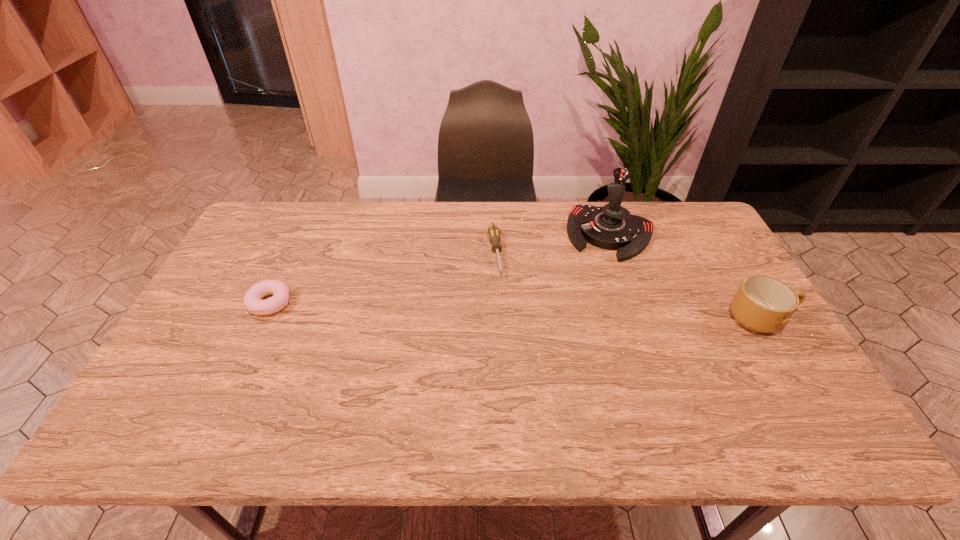
Locate an element on the screen. The image size is (960, 540). the leftmost object is located at coordinates (252, 299).

The width and height of the screenshot is (960, 540). Find the location of `mug`. mug is located at coordinates (762, 304).

Identify the location of the second tallest object. Image resolution: width=960 pixels, height=540 pixels. (762, 304).

This screenshot has width=960, height=540. In order to click on the third object from right to left in this screenshot , I will do `click(493, 232)`.

The height and width of the screenshot is (540, 960). Find the location of `the second object from right to left`. the second object from right to left is located at coordinates (612, 227).

I want to click on the tallest object, so click(612, 227).

Locate an element on the screen. The height and width of the screenshot is (540, 960). vacant region located on the front of the doughnut is located at coordinates (256, 334).

Locate an element on the screen. This screenshot has height=540, width=960. free space located 0.370m at the tip of the third object from right to left is located at coordinates (516, 386).

The width and height of the screenshot is (960, 540). Identify the location of free space located at the tip of the third object from right to left. (516, 393).

Where is `free spot located at the tip of the third object from right to left`? The height and width of the screenshot is (540, 960). free spot located at the tip of the third object from right to left is located at coordinates pos(510,352).